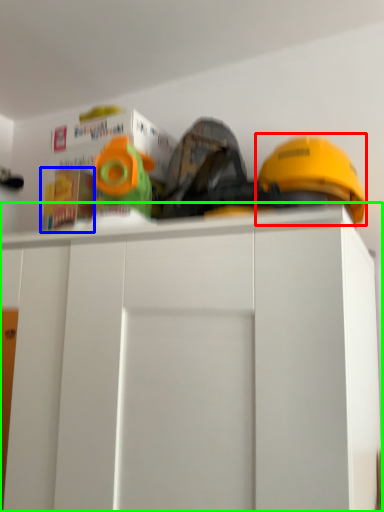
Question: Which object is the closest to the helmet (highlighted by a red box)? Choose among these: toy (highlighted by a blue box) or cabinetry (highlighted by a green box).

Choices:
 (A) toy
 (B) cabinetry

Answer: (B)